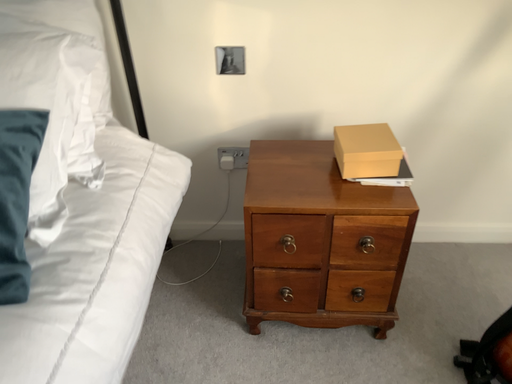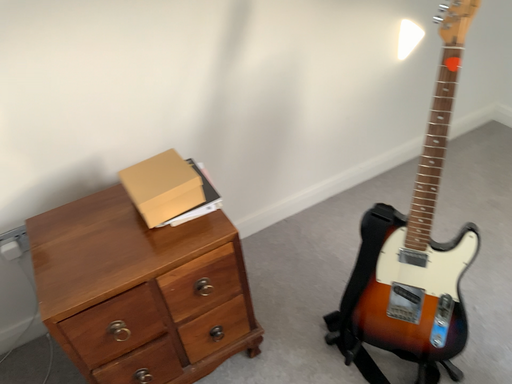
Question: Which way did the camera rotate in the video?

Choices:
 (A) rotated right
 (B) rotated left

Answer: (A)